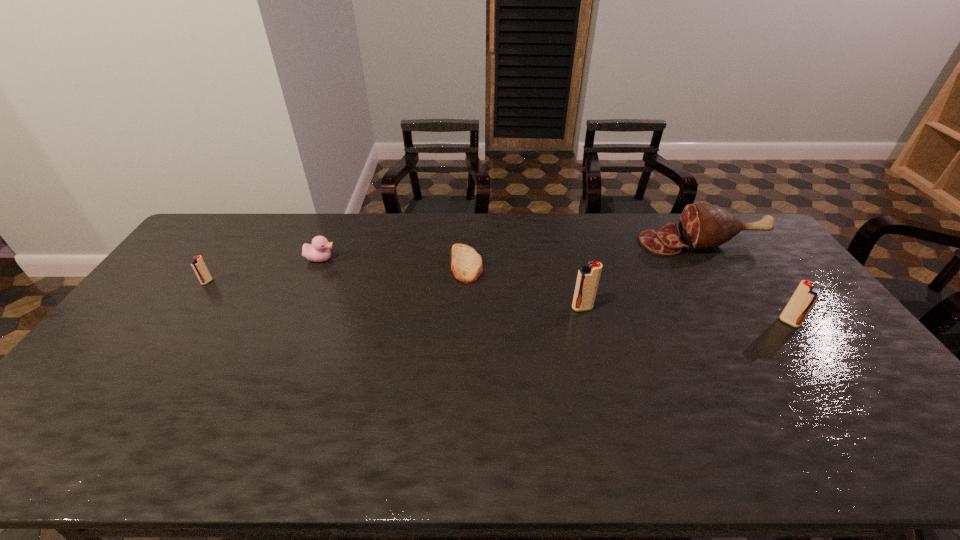
The height and width of the screenshot is (540, 960). Find the location of `vacant region located on the right of the farthest igniter`. vacant region located on the right of the farthest igniter is located at coordinates (332, 282).

The height and width of the screenshot is (540, 960). In order to click on blank area located on the front of the second nearest object in this screenshot , I will do `click(610, 420)`.

The height and width of the screenshot is (540, 960). What are the coordinates of `vacant space located 0.200m on the back of the nearest object` in the screenshot? It's located at (754, 273).

At what (x,y) coordinates should I click in order to perform the action: click on vacant space situated 0.290m at the sliced end of the ham. Please return your answer as a coordinate pair (x, y). Looking at the image, I should click on (559, 242).

The height and width of the screenshot is (540, 960). Identify the location of free point located at the sliced end of the ham. (547, 242).

Locate an element on the screen. vacant region located 0.290m at the sliced end of the ham is located at coordinates (559, 242).

Find the location of a particular element. free spot located 0.270m on the front-facing side of the duckling is located at coordinates (416, 259).

Where is `free spot located on the front of the fourth object from right to left`? free spot located on the front of the fourth object from right to left is located at coordinates (464, 345).

You are a GUI agent. You are given a task and a screenshot of the screen. Output one action in this format:
    pyautogui.click(x=<x>, y=<y>)
    Task: Click on the ham situated at the far edge
    The width and height of the screenshot is (960, 540).
    Given the screenshot: What is the action you would take?
    pyautogui.click(x=702, y=226)

This screenshot has height=540, width=960. Find the location of `pita bread at the far edge`. pita bread at the far edge is located at coordinates (466, 264).